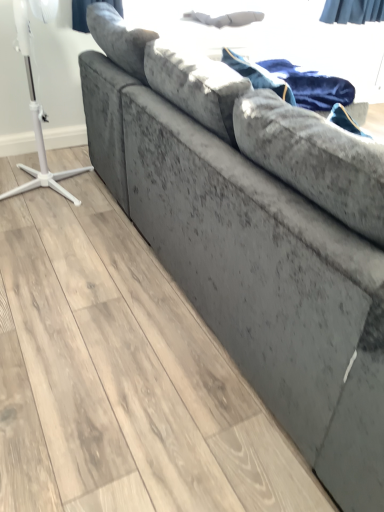
Question: Can we say white plastic tripod at left lies outside velvet blue blanket at upper right?

Choices:
 (A) no
 (B) yes

Answer: (B)

Question: Is white plastic tripod at left positioned with its back to velvet blue blanket at upper right?

Choices:
 (A) yes
 (B) no

Answer: (B)

Question: Would you consider white plastic tripod at left to be distant from velvet blue blanket at upper right?

Choices:
 (A) yes
 (B) no

Answer: (A)

Question: Is white plastic tripod at left smaller than velvet blue blanket at upper right?

Choices:
 (A) no
 (B) yes

Answer: (A)

Question: Does white plastic tripod at left lie in front of velvet blue blanket at upper right?

Choices:
 (A) no
 (B) yes

Answer: (B)

Question: From the image's perspective, does white plastic tripod at left appear higher than velvet blue blanket at upper right?

Choices:
 (A) yes
 (B) no

Answer: (B)

Question: From a real-world perspective, is velvet blue blanket at upper right located beneath white plastic tripod at left?

Choices:
 (A) yes
 (B) no

Answer: (B)

Question: Are velvet blue blanket at upper right and white plastic tripod at left making contact?

Choices:
 (A) yes
 (B) no

Answer: (B)

Question: Is velvet blue blanket at upper right facing away from white plastic tripod at left?

Choices:
 (A) yes
 (B) no

Answer: (A)

Question: Can you confirm if velvet blue blanket at upper right is positioned to the right of white plastic tripod at left?

Choices:
 (A) no
 (B) yes

Answer: (B)

Question: Considering the relative positions of velvet blue blanket at upper right and white plastic tripod at left in the image provided, is velvet blue blanket at upper right in front of white plastic tripod at left?

Choices:
 (A) no
 (B) yes

Answer: (A)

Question: Considering the relative sizes of velvet blue blanket at upper right and white plastic tripod at left in the image provided, is velvet blue blanket at upper right bigger than white plastic tripod at left?

Choices:
 (A) yes
 (B) no

Answer: (B)

Question: Is velvet blue blanket at upper right to the left or to the right of white plastic tripod at left in the image?

Choices:
 (A) left
 (B) right

Answer: (B)